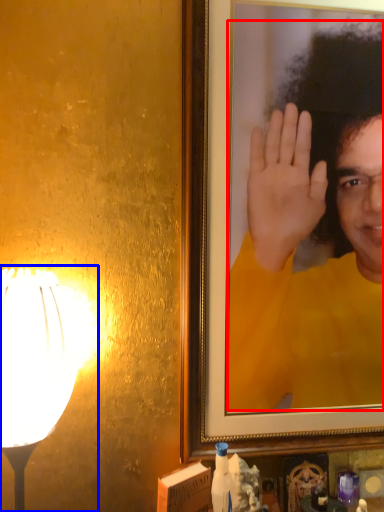
Question: Which object appears closest to the camera in this image, man (highlighted by a red box) or lamp (highlighted by a blue box)?

Choices:
 (A) man
 (B) lamp

Answer: (B)